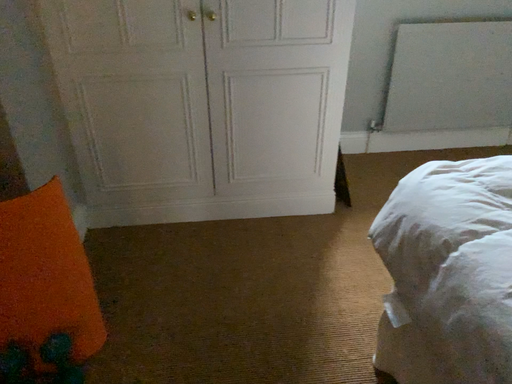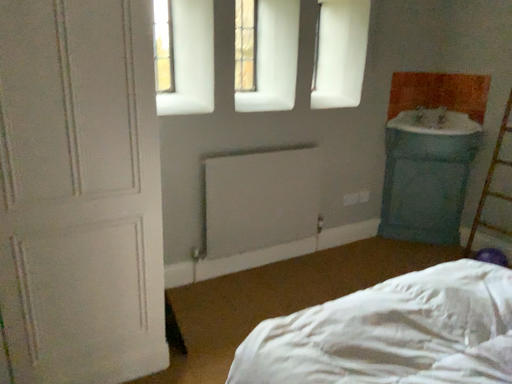
Question: How did the camera likely rotate when shooting the video?

Choices:
 (A) rotated upward
 (B) rotated downward

Answer: (A)